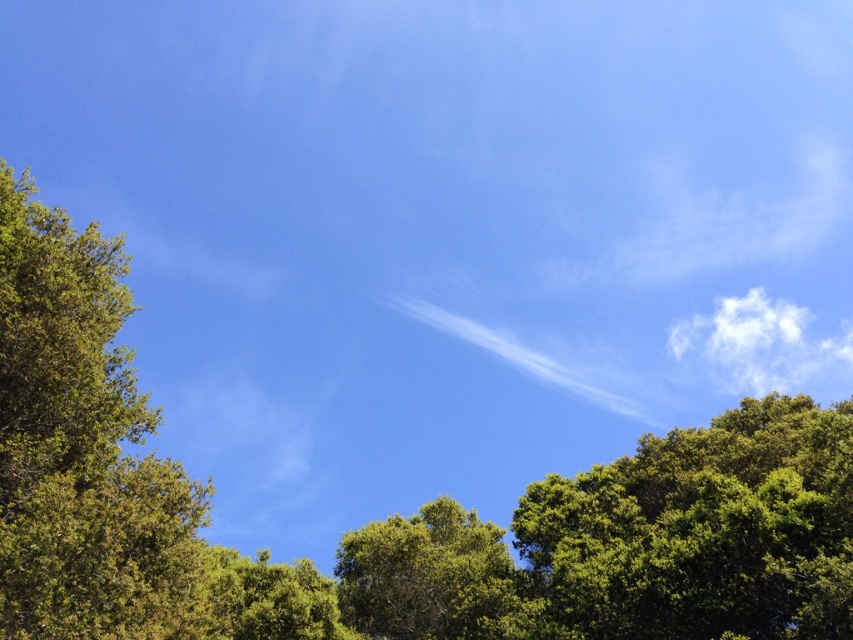
Question: Can you confirm if green leafy tree at left is wider than green leafy tree at upper right?

Choices:
 (A) yes
 (B) no

Answer: (B)

Question: Considering the relative positions of green leafy tree at center and green leafy tree at lower center in the image provided, where is green leafy tree at center located with respect to green leafy tree at lower center?

Choices:
 (A) above
 (B) below

Answer: (B)

Question: Among these objects, which one is farthest from the camera?

Choices:
 (A) green leafy tree at upper right
 (B) green leafy tree at left
 (C) green leafy tree at center

Answer: (C)

Question: Which is farther from the green leafy tree at left?

Choices:
 (A) green leafy tree at upper right
 (B) green leafy tree at center

Answer: (B)

Question: Among these objects, which one is farthest from the camera?

Choices:
 (A) green leafy tree at lower center
 (B) green leafy tree at upper right
 (C) green leafy tree at left
 (D) green leafy tree at center

Answer: (D)

Question: Does green leafy tree at left have a smaller size compared to green leafy tree at center?

Choices:
 (A) no
 (B) yes

Answer: (B)